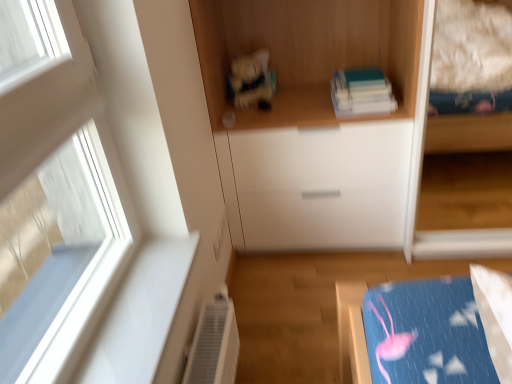
What do you see at coordinates (362, 92) in the screenshot?
I see `hardcover book at upper center` at bounding box center [362, 92].

What do you see at coordinates (252, 80) in the screenshot? Image resolution: width=512 pixels, height=384 pixels. I see `matte plastic toy at center` at bounding box center [252, 80].

In the scene shown: In order to face matte plastic toy at center, should I rotate leftwards or rightwards?

To face it directly, rotate left by 0.493 degrees.

What are the coordinates of `wooden books at upper center` in the screenshot? It's located at (307, 53).

Locate an element on the screen. hardcover book at upper center is located at coordinates (362, 92).

Is point (259, 111) farther from camera compared to point (397, 210)?

That is False.

Is wooden books at upper center facing away from white glossy drawer at center?

No, wooden books at upper center is not facing the opposite direction of white glossy drawer at center.

Is wooden books at upper center positioned behind white glossy drawer at center?

No, it is in front of white glossy drawer at center.

How many degrees apart are the facing directions of wooden books at upper center and white glossy drawer at center?

The angle between the facing direction of wooden books at upper center and the facing direction of white glossy drawer at center is 0.922 degrees.

Is matte plastic toy at center beside white glossy drawer at center?

No.

Which of these two, matte plastic toy at center or white glossy drawer at center, stands shorter?

Standing shorter between the two is matte plastic toy at center.

Where is `toy above the white glossy drawer at center (from the image's perspective)`? The image size is (512, 384). toy above the white glossy drawer at center (from the image's perspective) is located at coordinates (252, 80).

From the picture: How many degrees apart are the facing directions of wooden books at upper center and matte plastic toy at center?

wooden books at upper center and matte plastic toy at center are facing 16.5 degrees away from each other.

From a real-world perspective, which object rests below the other?

matte plastic toy at center.

Considering the sizes of objects wooden books at upper center and matte plastic toy at center in the image provided, who is shorter, wooden books at upper center or matte plastic toy at center?

matte plastic toy at center.

Is wooden books at upper center spatially inside matte plastic toy at center, or outside of it?

wooden books at upper center is not enclosed by matte plastic toy at center.

Between white glossy drawer at center and wooden books at upper center, which one has smaller size?

With smaller size is wooden books at upper center.

Can you tell me how much white glossy drawer at center and wooden books at upper center differ in facing direction?

The facing directions of white glossy drawer at center and wooden books at upper center are 0.922 degrees apart.

Can wooden books at upper center be found inside white glossy drawer at center?

Actually, wooden books at upper center is outside white glossy drawer at center.

Which object is closer to the camera, white glossy drawer at center or wooden books at upper center?

wooden books at upper center is more forward.

Could you tell me if wooden books at upper center is facing hardcover book at upper center?

Yes, wooden books at upper center is turned towards hardcover book at upper center.

You are a GUI agent. You are given a task and a screenshot of the screen. Output one action in this format:
    pyautogui.click(x=<x>, y=<y>)
    Task: Click on the book that is under the wooden books at upper center (from a real-world perspective)
    
    Given the screenshot: What is the action you would take?
    pyautogui.click(x=362, y=92)

In the scene shown: Is wooden books at upper center at the right side of hardcover book at upper center?

In fact, wooden books at upper center is to the left of hardcover book at upper center.

From a real-world perspective, who is located lower, wooden books at upper center or hardcover book at upper center?

From a 3D spatial view, hardcover book at upper center is below.

From the image's perspective, is white glossy drawer at center on matte plastic toy at center?

No, from the image's perspective, white glossy drawer at center is not on top of matte plastic toy at center.

From the picture: From a real-world perspective, is white glossy drawer at center physically located above or below matte plastic toy at center?

Clearly, from a real-world perspective, white glossy drawer at center is below matte plastic toy at center.

Which of these two, white glossy drawer at center or matte plastic toy at center, stands taller?

white glossy drawer at center is taller.

Could you tell me if white glossy drawer at center is facing matte plastic toy at center?

No, white glossy drawer at center does not turn towards matte plastic toy at center.

Which of these two, hardcover book at upper center or wooden books at upper center, is bigger?

wooden books at upper center.

Find the location of a particular element. cupboard positioned vertically above the hardcover book at upper center (from a real-world perspective) is located at coordinates (307, 53).

Can you confirm if hardcover book at upper center is positioned to the right of wooden books at upper center?

Indeed, hardcover book at upper center is positioned on the right side of wooden books at upper center.

From the image's perspective, between hardcover book at upper center and wooden books at upper center, which one is located above?

wooden books at upper center is shown above in the image.

This screenshot has height=384, width=512. What are the coordinates of `cupboard that is above the white glossy drawer at center (from the image's perspective)` in the screenshot? It's located at (307, 53).

Where is `drawer to the right of matte plastic toy at center`? The height and width of the screenshot is (384, 512). drawer to the right of matte plastic toy at center is located at coordinates (320, 185).

In the scene shown: Looking at the image, which one is located further to matte plastic toy at center, hardcover book at upper center or white glossy drawer at center?

The object further to matte plastic toy at center is white glossy drawer at center.

Considering their positions, is matte plastic toy at center positioned further to hardcover book at upper center than wooden books at upper center?

matte plastic toy at center is further to hardcover book at upper center.

Based on their spatial positions, is white glossy drawer at center or hardcover book at upper center further from wooden books at upper center?

Based on the image, white glossy drawer at center appears to be further to wooden books at upper center.

Estimate the real-world distances between objects in this image. Which object is further from matte plastic toy at center, hardcover book at upper center or wooden books at upper center?

hardcover book at upper center lies further to matte plastic toy at center than the other object.

Estimate the real-world distances between objects in this image. Which object is further from wooden books at upper center, white glossy drawer at center or matte plastic toy at center?

→ white glossy drawer at center.

Looking at the image, which one is located closer to matte plastic toy at center, white glossy drawer at center or wooden books at upper center?

Based on the image, wooden books at upper center appears to be nearer to matte plastic toy at center.

Looking at the image, which one is located closer to white glossy drawer at center, wooden books at upper center or hardcover book at upper center?

hardcover book at upper center lies closer to white glossy drawer at center than the other object.

Estimate the real-world distances between objects in this image. Which object is further from hardcover book at upper center, wooden books at upper center or white glossy drawer at center?

white glossy drawer at center is further to hardcover book at upper center.

This screenshot has height=384, width=512. I want to click on book between wooden books at upper center and matte plastic toy at center in the front-back direction, so click(x=362, y=92).

At what (x,y) coordinates should I click in order to perform the action: click on book between wooden books at upper center and white glossy drawer at center in the up-down direction. Please return your answer as a coordinate pair (x, y). Image resolution: width=512 pixels, height=384 pixels. Looking at the image, I should click on (362, 92).

Identify the location of drawer between wooden books at upper center and matte plastic toy at center along the z-axis. The image size is (512, 384). (320, 185).

You are a GUI agent. You are given a task and a screenshot of the screen. Output one action in this format:
    pyautogui.click(x=<x>, y=<y>)
    Task: Click on the drawer between matte plastic toy at center and hardcover book at upper center
    
    Given the screenshot: What is the action you would take?
    pyautogui.click(x=320, y=185)